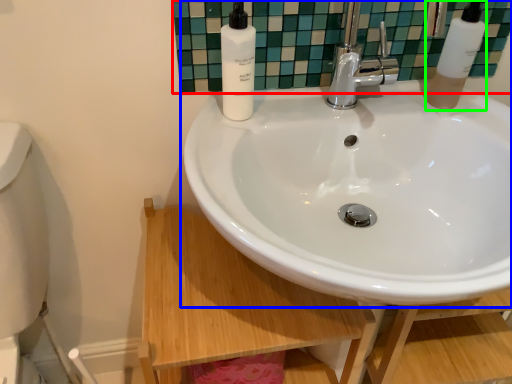
Question: Estimate the real-world distances between objects in this image. Which object is closer to mirror (highlighted by a red box), sink (highlighted by a blue box) or soap dispenser (highlighted by a green box)?

Choices:
 (A) sink
 (B) soap dispenser

Answer: (B)